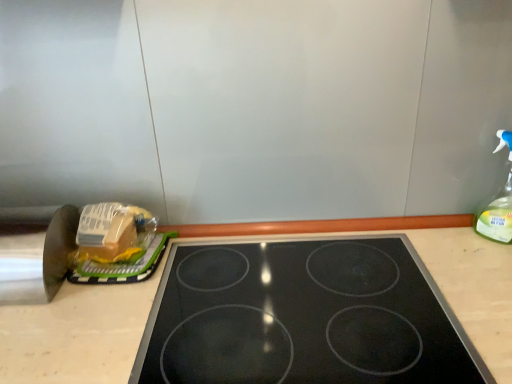
Identify the location of translucent plastic bag at left. This screenshot has width=512, height=384. (113, 233).

Identify the location of translucent plastic bag at left. coord(113,233).

From the image's perspective, between clear plastic spray bottle at right and black glass gas stove at center, who is located below?

From the image's view, black glass gas stove at center is below.

Considering the relative sizes of clear plastic spray bottle at right and black glass gas stove at center in the image provided, is clear plastic spray bottle at right wider than black glass gas stove at center?

Incorrect, the width of clear plastic spray bottle at right does not surpass that of black glass gas stove at center.

Is black glass gas stove at center at the back of clear plastic spray bottle at right?

No, clear plastic spray bottle at right's orientation is not away from black glass gas stove at center.

From a real-world perspective, does clear plastic spray bottle at right sit lower than black glass gas stove at center?

No, from a real-world perspective, clear plastic spray bottle at right is not under black glass gas stove at center.

Who is smaller, black glass gas stove at center or translucent plastic bag at left?

translucent plastic bag at left is smaller.

Is black glass gas stove at center inside the boundaries of translucent plastic bag at left, or outside?

black glass gas stove at center is outside translucent plastic bag at left.

Does black glass gas stove at center turn towards translucent plastic bag at left?

No.

Considering the positions of point (383, 382) and point (495, 209), is point (383, 382) closer or farther from the camera than point (495, 209)?

Point (383, 382) appears to be closer to the viewer than point (495, 209).

Is black glass gas stove at center positioned with its back to clear plastic spray bottle at right?

No.

Is there a large distance between black glass gas stove at center and clear plastic spray bottle at right?

No, black glass gas stove at center is not far away from clear plastic spray bottle at right.

From a real-world perspective, is black glass gas stove at center beneath clear plastic spray bottle at right?

Correct, in the physical world, black glass gas stove at center is lower than clear plastic spray bottle at right.

From a real-world perspective, which object stands above the other?

clear plastic spray bottle at right.

What's the angular difference between translucent plastic bag at left and clear plastic spray bottle at right's facing directions?

The angular difference between translucent plastic bag at left and clear plastic spray bottle at right is 50.7 degrees.

Would you say translucent plastic bag at left is outside clear plastic spray bottle at right?

Absolutely, translucent plastic bag at left is external to clear plastic spray bottle at right.

From the picture: How far apart are clear plastic spray bottle at right and translucent plastic bag at left?

They are 84.77 centimeters apart.

From the image's perspective, is clear plastic spray bottle at right positioned above or below translucent plastic bag at left?

clear plastic spray bottle at right is above translucent plastic bag at left.

Is clear plastic spray bottle at right positioned in front of translucent plastic bag at left?

That is True.

Based on their positions, is clear plastic spray bottle at right located to the left or right of translucent plastic bag at left?

clear plastic spray bottle at right is to the right of translucent plastic bag at left.

From the image's perspective, relative to black glass gas stove at center, is translucent plastic bag at left above or below?

translucent plastic bag at left is above black glass gas stove at center.

The image size is (512, 384). Find the location of `gas stove that appears below the translucent plastic bag at left (from the image's perspective)`. gas stove that appears below the translucent plastic bag at left (from the image's perspective) is located at coordinates (303, 317).

Does translucent plastic bag at left have a larger size compared to black glass gas stove at center?

Actually, translucent plastic bag at left might be smaller than black glass gas stove at center.

Identify the location of bottle that is on the right side of black glass gas stove at center. The height and width of the screenshot is (384, 512). (498, 203).

The height and width of the screenshot is (384, 512). In order to click on gas stove in front of the translucent plastic bag at left in this screenshot , I will do `click(303, 317)`.

Based on the photo, which object lies further to the anchor point black glass gas stove at center, translucent plastic bag at left or clear plastic spray bottle at right?

Based on the image, clear plastic spray bottle at right appears to be further to black glass gas stove at center.

Looking at this image, estimate the real-world distances between objects in this image. Which object is further from translucent plastic bag at left, clear plastic spray bottle at right or black glass gas stove at center?

clear plastic spray bottle at right is further to translucent plastic bag at left.

Estimate the real-world distances between objects in this image. Which object is further from clear plastic spray bottle at right, translucent plastic bag at left or black glass gas stove at center?

The object further to clear plastic spray bottle at right is translucent plastic bag at left.

Estimate the real-world distances between objects in this image. Which object is further from translucent plastic bag at left, black glass gas stove at center or clear plastic spray bottle at right?

Based on the image, clear plastic spray bottle at right appears to be further to translucent plastic bag at left.

Based on their spatial positions, is black glass gas stove at center or translucent plastic bag at left further from clear plastic spray bottle at right?

translucent plastic bag at left is further to clear plastic spray bottle at right.

Considering their positions, is clear plastic spray bottle at right positioned further to black glass gas stove at center than translucent plastic bag at left?

clear plastic spray bottle at right.

This screenshot has width=512, height=384. Identify the location of gas stove between translucent plastic bag at left and clear plastic spray bottle at right from left to right. (303, 317).